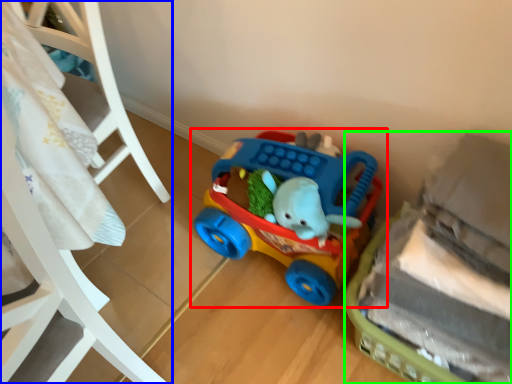
Question: Considering the real-world distances, which object is farthest from toy (highlighted by a red box)? furniture (highlighted by a blue box) or toy (highlighted by a green box)?

Choices:
 (A) furniture
 (B) toy

Answer: (A)